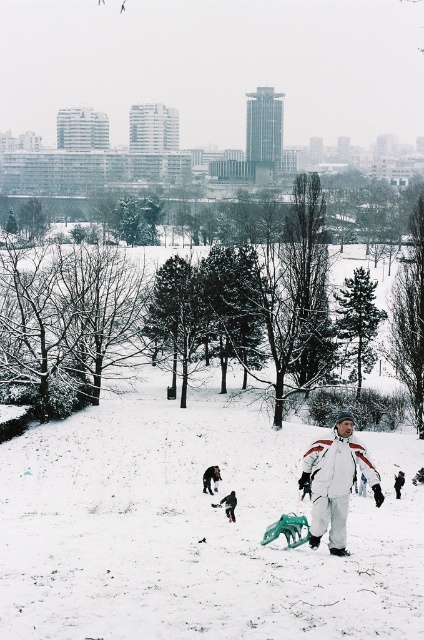
In the scene shown: You are standing in the snowy park and want to take a photo of the dark fur coat at lower center without the white fluffy snow at center blocking the view. Is it possible to do so?

The white fluffy snow at center is closer to the viewer than the dark fur coat at lower center. Therefore, the white fluffy snow at center would block the view of the dark fur coat at lower center, making it impossible to take a clear photo without the snow obstructing it.

Looking at this image, you are standing at the camera position and want to reach point (262, 637). Is the distance more than 25 feet?

Yes, the distance between the camera and point (262, 637) is 27.49 feet, which is more than 25 feet.

You are standing at the edge of the snowy park and see the white fluffy snow at center and the dark fur coat at lower center. Which object is located to the right side from your perspective?

The white fluffy snow at center is located to the right of the dark fur coat at lower center.